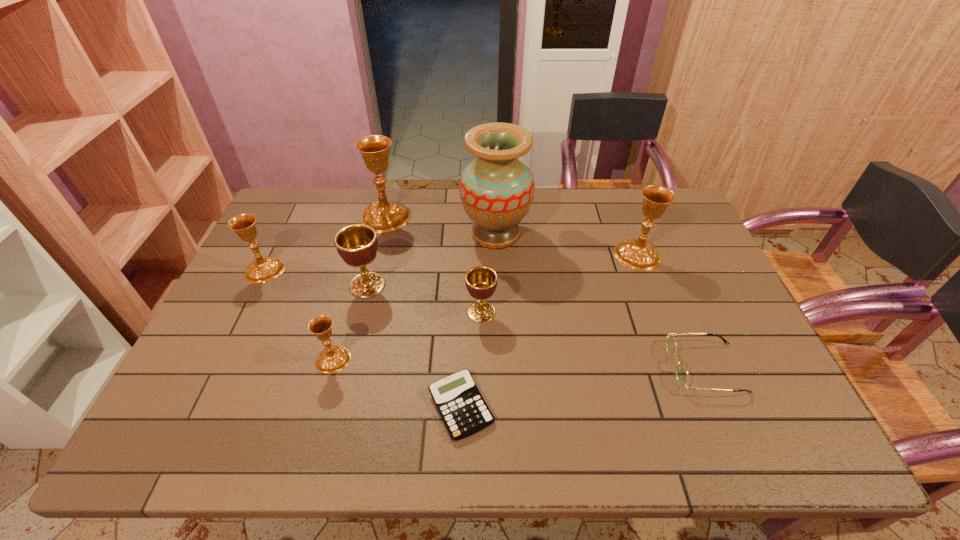
Where is `object at the left edge`? This screenshot has height=540, width=960. object at the left edge is located at coordinates (262, 269).

Find the location of a particular element. The image size is (960, 540). chalice that is at the right edge is located at coordinates (638, 254).

This screenshot has width=960, height=540. In order to click on spectacles located at the right edge in this screenshot , I will do `click(681, 372)`.

This screenshot has height=540, width=960. I want to click on free region at the far edge, so click(x=598, y=225).

This screenshot has height=540, width=960. Find the location of `vacant region at the near edge of the desktop`. vacant region at the near edge of the desktop is located at coordinates (666, 426).

Where is `vacant area at the far left corner`? vacant area at the far left corner is located at coordinates (289, 222).

The width and height of the screenshot is (960, 540). Identify the location of free space at the near left corner of the desktop. (168, 436).

Where is `empty location between the rightmost chalice and the tallest object`? empty location between the rightmost chalice and the tallest object is located at coordinates (566, 244).

Identify the location of free space between the tallest object and the green spectacles. (601, 301).

Find the location of `unoccupied position between the smallest gold chalice and the leftmost gold chalice`. unoccupied position between the smallest gold chalice and the leftmost gold chalice is located at coordinates (300, 315).